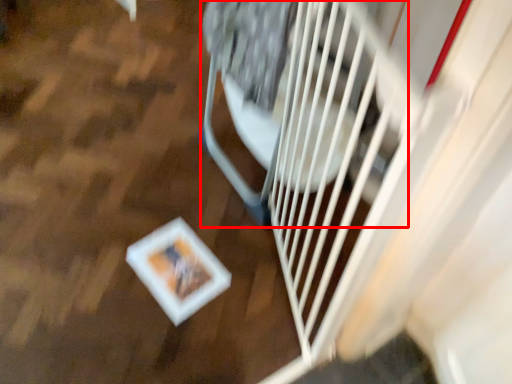
Question: Where is wide (annotated by the red box) located in relation to wood in the image?

Choices:
 (A) right
 (B) left

Answer: (A)